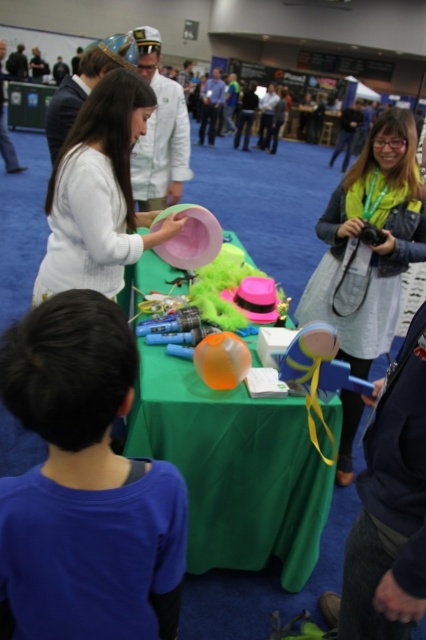
Question: Which object is farther from the camera taking this photo?

Choices:
 (A) blue fabric shirt at lower left
 (B) translucent orange ball at center
 (C) blue rubber toy at center

Answer: (B)

Question: Which of the following is the farthest from the observer?

Choices:
 (A) (126, 129)
 (B) (281, 365)
 (C) (134, 410)
 (D) (347, 323)

Answer: (D)

Question: Among these points, which one is nearest to the camera?

Choices:
 (A) click(x=95, y=90)
 (B) click(x=167, y=592)

Answer: (B)

Question: Is blue rubber toy at center to the right of translucent orange ball at center from the viewer's perspective?

Choices:
 (A) no
 (B) yes

Answer: (B)

Question: Does blue fabric shirt at lower left have a larger size compared to matte green dress at right?

Choices:
 (A) no
 (B) yes

Answer: (A)

Question: Observing the image, what is the correct spatial positioning of blue rubber toy at center in reference to translucent orange ball at center?

Choices:
 (A) left
 (B) right

Answer: (B)